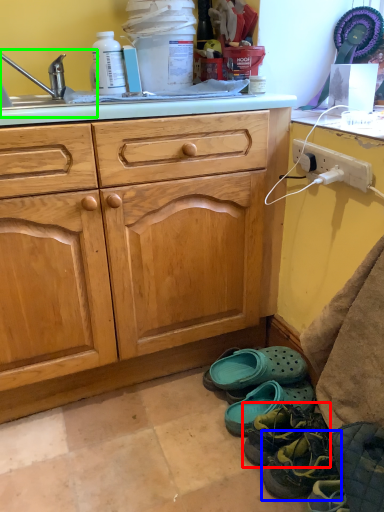
Question: Which object is positioned closest to footwear (highlighted by a red box)? Select from footwear (highlighted by a blue box) and sink (highlighted by a green box).

Choices:
 (A) footwear
 (B) sink

Answer: (A)